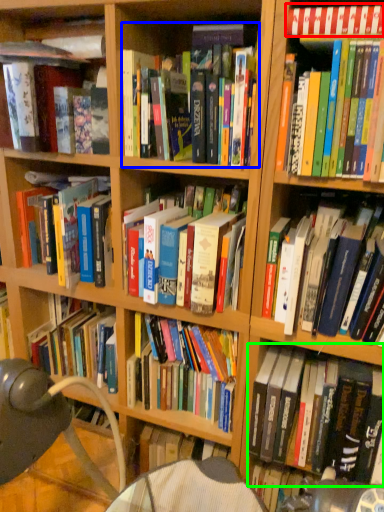
Question: Which object is positioned closest to book (highlighted by a red box)? Select from book (highlighted by a blue box) and book (highlighted by a green box).

Choices:
 (A) book
 (B) book

Answer: (A)